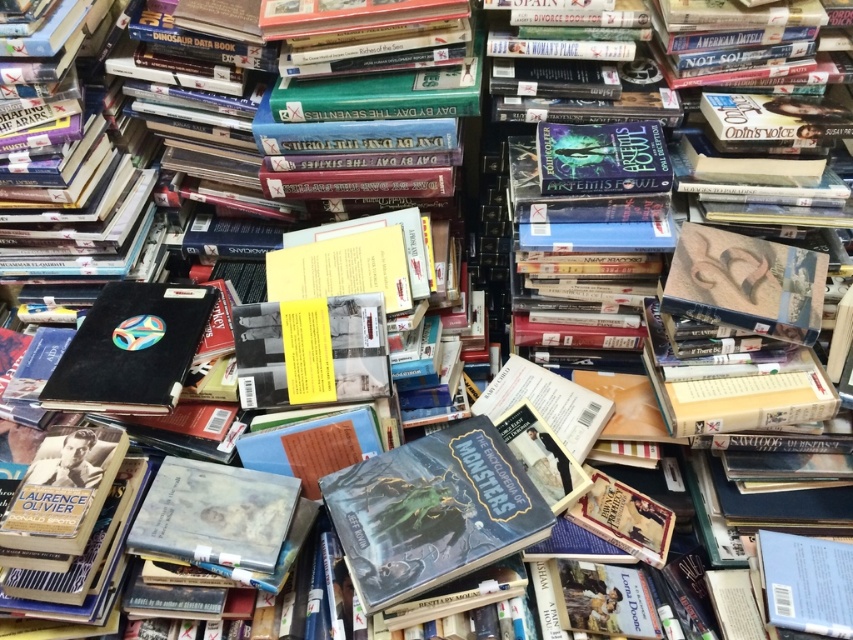
Who is shorter, hardcover book at center or black matte book at center?

Standing shorter between the two is black matte book at center.

Is point (380, 605) more distant than point (186, 371)?

No, it is in front of (186, 371).

This screenshot has width=853, height=640. Describe the element at coordinates (432, 512) in the screenshot. I see `hardcover book at center` at that location.

I want to click on hardcover book at center, so click(432, 512).